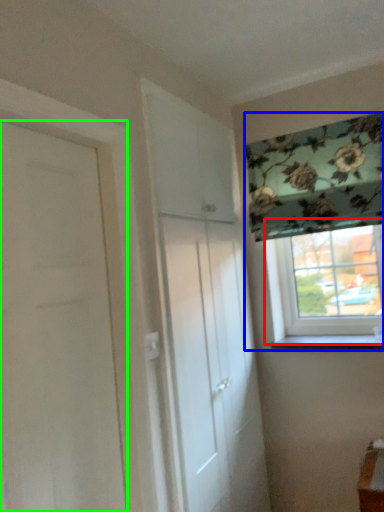
Question: Based on their relative distances, which object is nearer to window (highlighted by a red box)? Choose from window (highlighted by a blue box) and door (highlighted by a green box).

Choices:
 (A) window
 (B) door

Answer: (A)